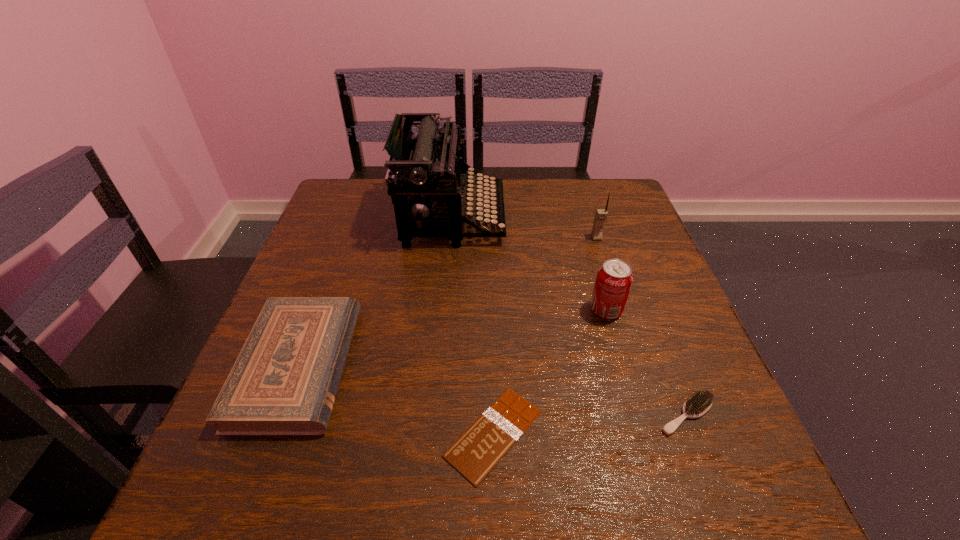
Image resolution: width=960 pixels, height=540 pixels. Identify the location of vacant area situated on the spine side of the leftmost object. (459, 366).

Locate an element on the screen. free space located on the left of the scrubbing brush is located at coordinates (479, 415).

You are a GUI agent. You are given a task and a screenshot of the screen. Output one action in this format:
    pyautogui.click(x=<x>, y=<y>)
    Task: Click on the free space located 0.090m on the back of the shortest object
    The height and width of the screenshot is (540, 960).
    Given the screenshot: What is the action you would take?
    pyautogui.click(x=492, y=347)

Image resolution: width=960 pixels, height=540 pixels. I want to click on object situated at the far edge, so click(x=430, y=171).

Where is `object present at the near edge`? object present at the near edge is located at coordinates (476, 452).

Locate an element on the screen. object located at the left edge is located at coordinates (284, 381).

The image size is (960, 540). Identify the location of cellular telephone present at the right edge. (601, 214).

Image resolution: width=960 pixels, height=540 pixels. Identify the location of soda that is at the right edge. (614, 279).

This screenshot has width=960, height=540. In order to click on scrubbing brush present at the right edge in this screenshot , I will do `click(699, 403)`.

Where is `vacant space at the far edge of the desktop`? vacant space at the far edge of the desktop is located at coordinates (533, 224).